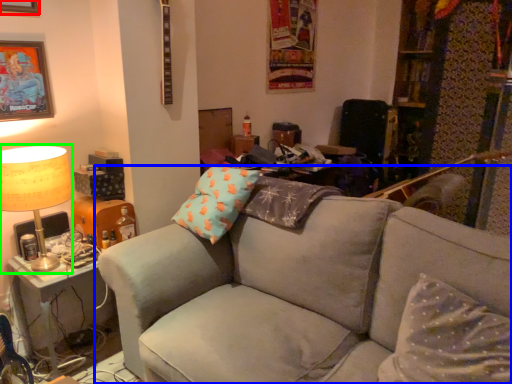
Question: Which is nearer to the picture frame (highlighted by a red box)? studio couch (highlighted by a blue box) or table lamp (highlighted by a green box).

Choices:
 (A) studio couch
 (B) table lamp

Answer: (B)